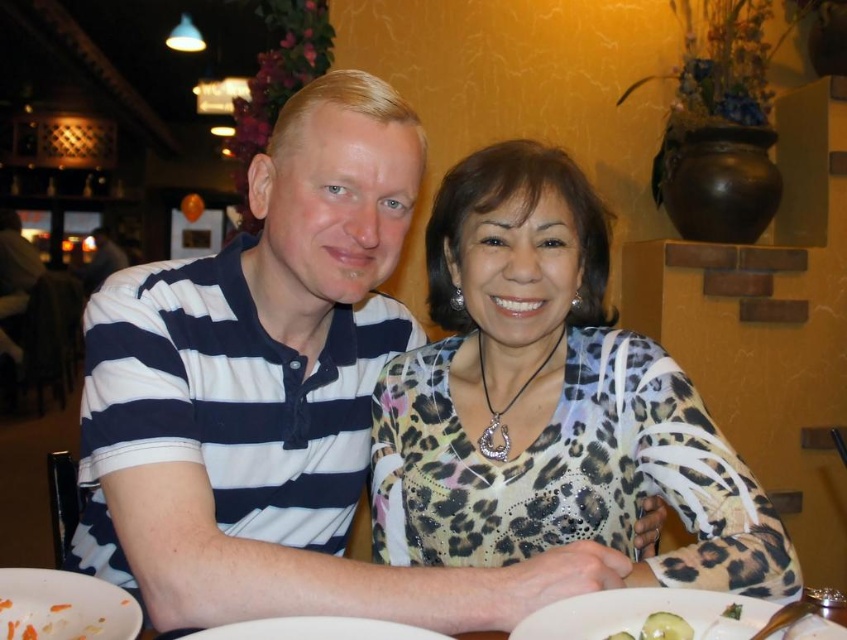
You are standing at the camera position looking at the scene. There is a point marked at coordinates point (36, 579). If you want to touch that point with a ruler that is 70 centimeters long, will the ruler be long enough?

The distance between point (36, 579) and the camera is 75.14 centimeters. Since the ruler is only 70 centimeters long, it will not be long enough to reach the point.

You are a waiter in a restaurant and need to serve a drink to the person wearing the leopard print blouse at center. The white glossy plate at lower center is in the way. Can you slide the drink around the plate without spilling it?

The leopard print blouse at center is further to the viewer than the white glossy plate at lower center, so you can slide the drink around the plate by moving it closer to the blouse since it is nearer to you than the plate.

You are a server at this restaurant and need to clear the table. The two plates, the white ceramic plate at lower center and the white glossy plate at lower center, are currently on the table. If you want to stack them to save space, can you fit them together without overlapping?

The white ceramic plate at lower center and the white glossy plate at lower center are 7.20 inches apart. Since stacking requires the plates to be placed one on top of the other, the distance between them is not relevant to stacking. However, the question is about fitting them together without overlapping, which depends on their sizes. The description only provides the distance between them, not their individual sizes. Therefore, it is impossible to determine if they can be stacked without overlapping based